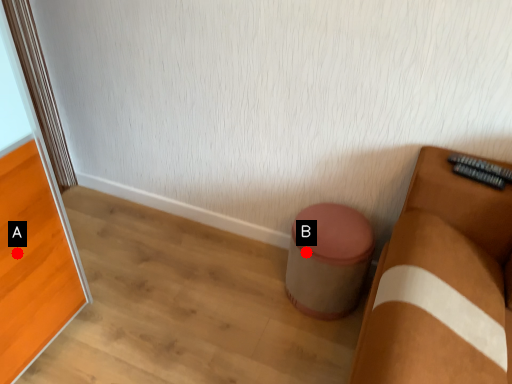
Question: Two points are circled on the image, labeled by A and B beside each circle. Which of the following is the farthest from the observer?

Choices:
 (A) A is further
 (B) B is further

Answer: (B)